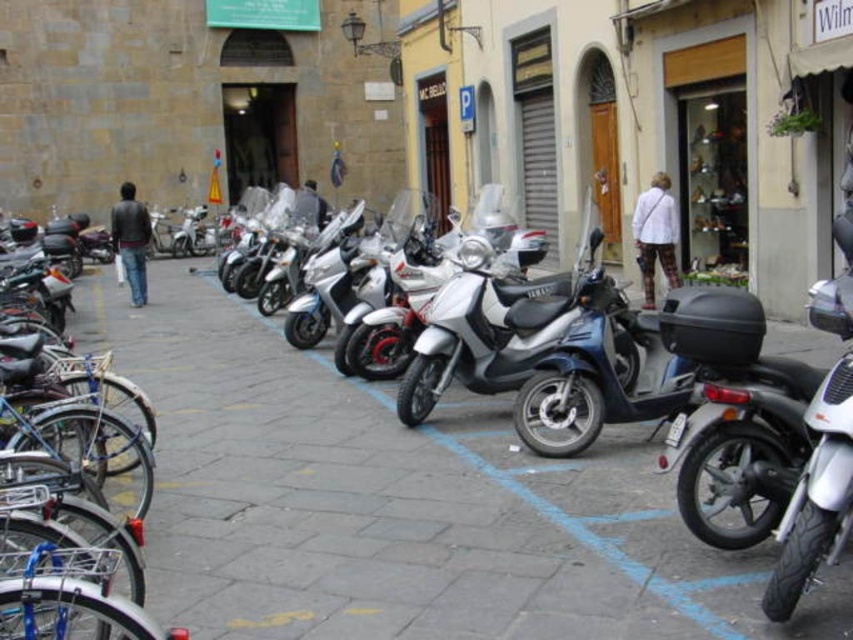
You are standing at the point marked by the coordinates point [398,502] in the image. What type of surface are you currently standing on?

The point [398,502] marks matte gray pavement at center, so you are standing on matte gray pavement.

You are a delivery person needing to park your vehicle. You have a motorcycle that is 1.5 meters long. The parking space is marked by the matte gray pavement at center. Can your motorcycle fit in the parking space if the metallic silver scooter at center is already occupying part of it?

The matte gray pavement at center is shorter than the metallic silver scooter at center, which means the parking space is smaller than the scooter. Since your motorcycle is 1.5 meters long, it would not fit in the parking space if the scooter is already taking up part of it.